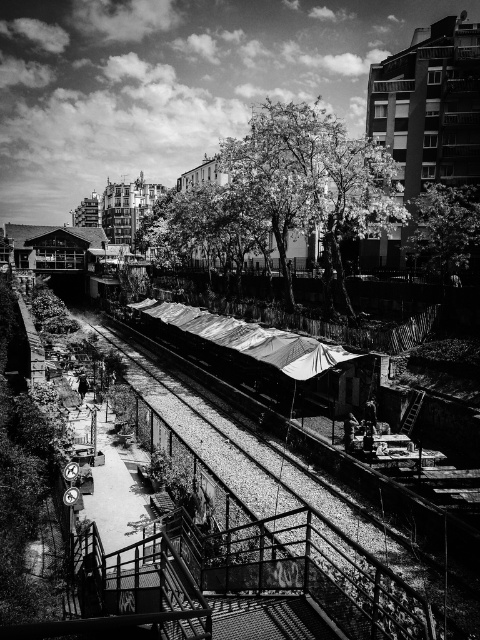
You are standing at the point labeled as point (245, 348) in the image. What object are you directly facing?

You are directly facing the metallic corrugated roof at center as indicated by the point (245, 348).